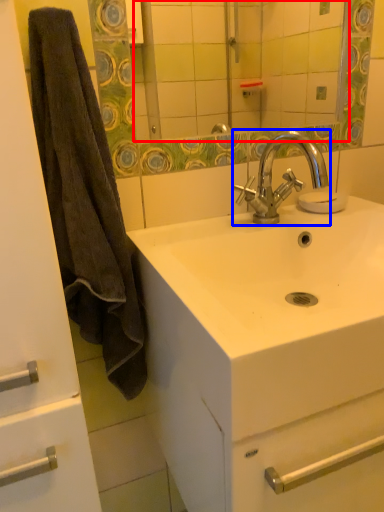
Question: Among these objects, which one is farthest to the camera, mirror (highlighted by a red box) or tap (highlighted by a blue box)?

Choices:
 (A) mirror
 (B) tap

Answer: (A)